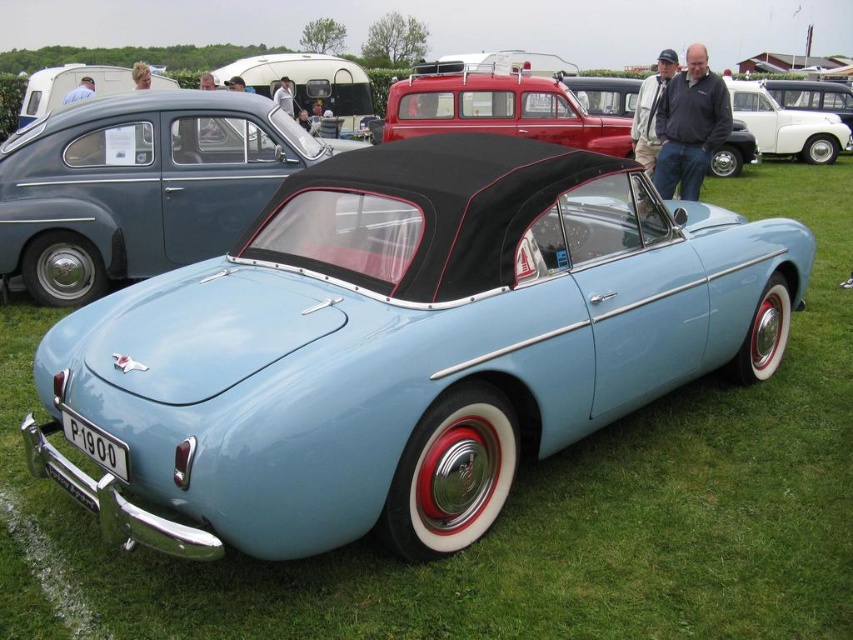
Between light blue matte convertible at center and white glossy van at upper center, which one has less height?

light blue matte convertible at center

Who is more forward, [222,198] or [732,99]?

Point [222,198]

Locate an element on the screen. Image resolution: width=853 pixels, height=640 pixels. light blue matte convertible at center is located at coordinates (140, 186).

What do you see at coordinates (498, 108) in the screenshot? The image size is (853, 640). I see `metallic red station wagon at center` at bounding box center [498, 108].

Locate an element on the screen. The image size is (853, 640). metallic red station wagon at center is located at coordinates (498, 108).

Consider the image. Is light blue matte convertible at center to the right of metallic red station wagon at center from the viewer's perspective?

Incorrect, light blue matte convertible at center is not on the right side of metallic red station wagon at center.

Who is more forward, (96, 172) or (531, 112)?

Point (96, 172)

This screenshot has height=640, width=853. I want to click on light blue matte convertible at center, so click(140, 186).